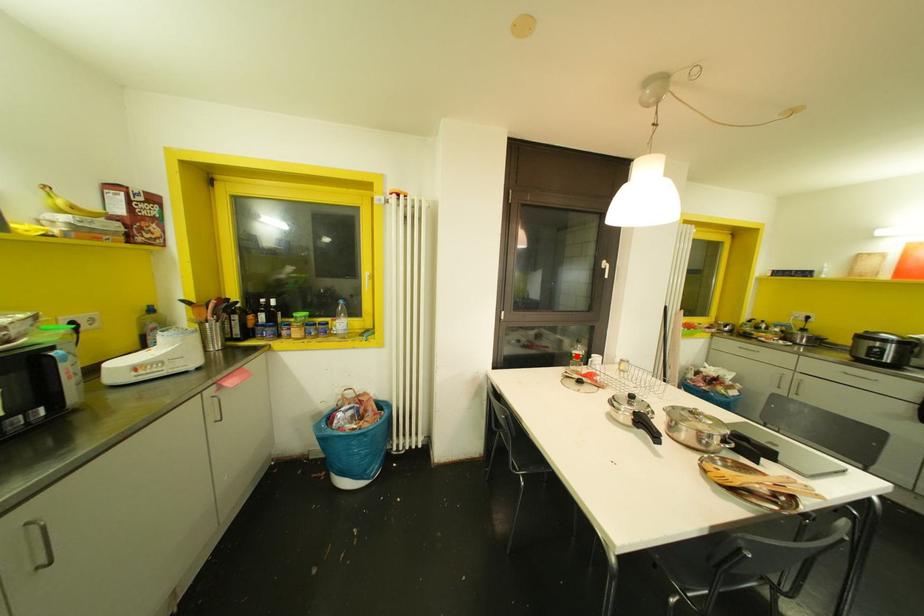
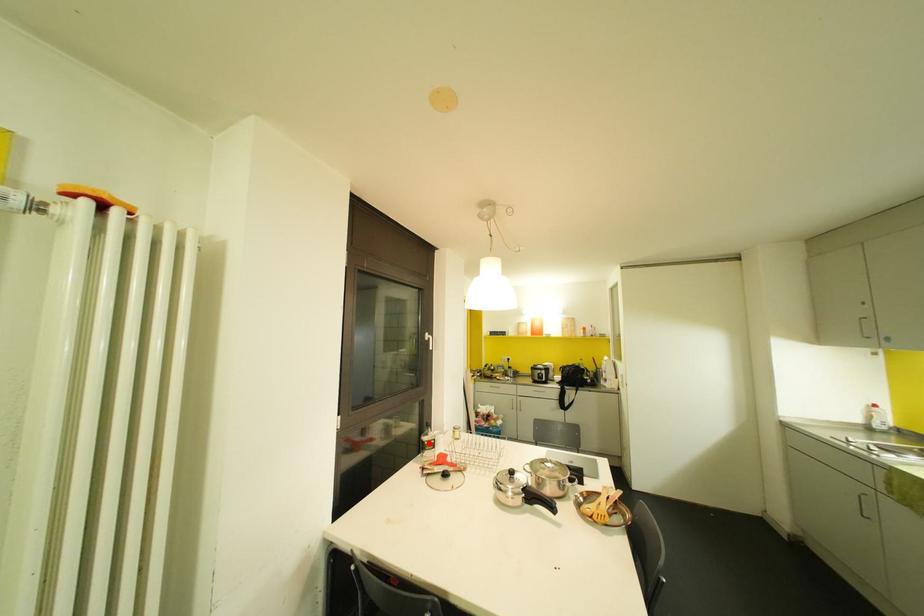
I am providing you with two images of the same scene from different viewpoints. A red point is marked on the first image and another point is marked on the second image. Does the point marked in image1 correspond to the same location as the one in image2?

Yes